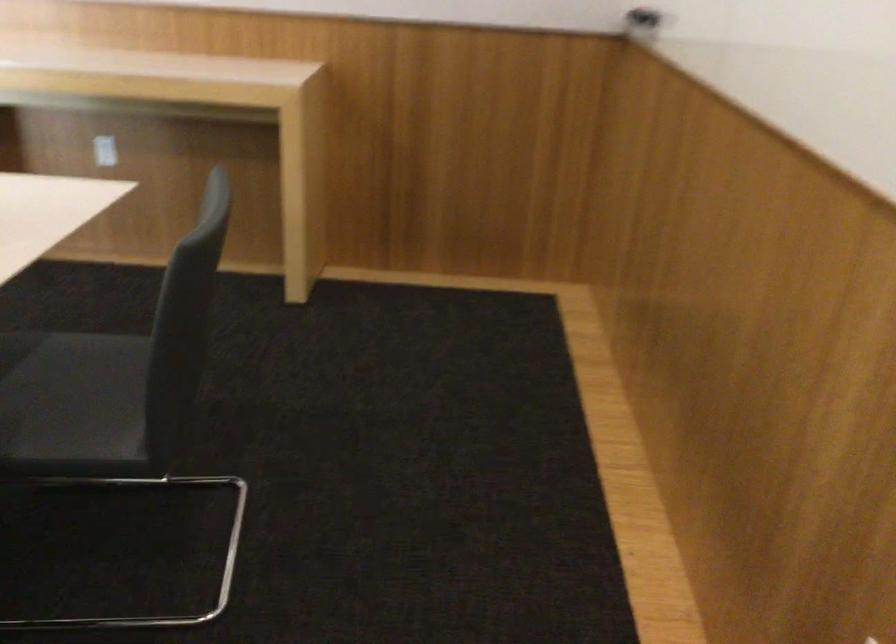
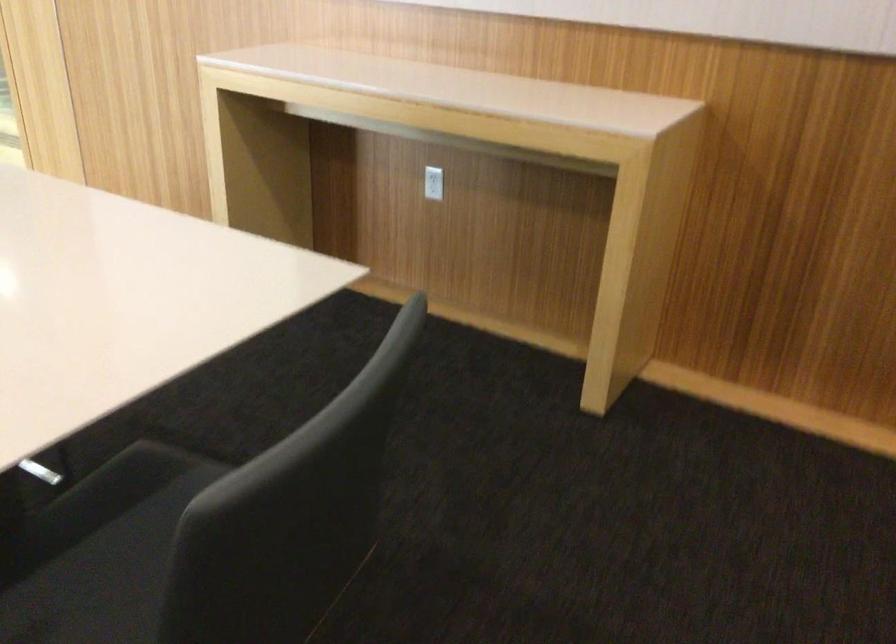
Question: Based on the continuous images, in which direction is the camera rotating? Reply with the corresponding letter.

Choices:
 (A) Left
 (B) Right
 (C) Up
 (D) Down

Answer: (A)